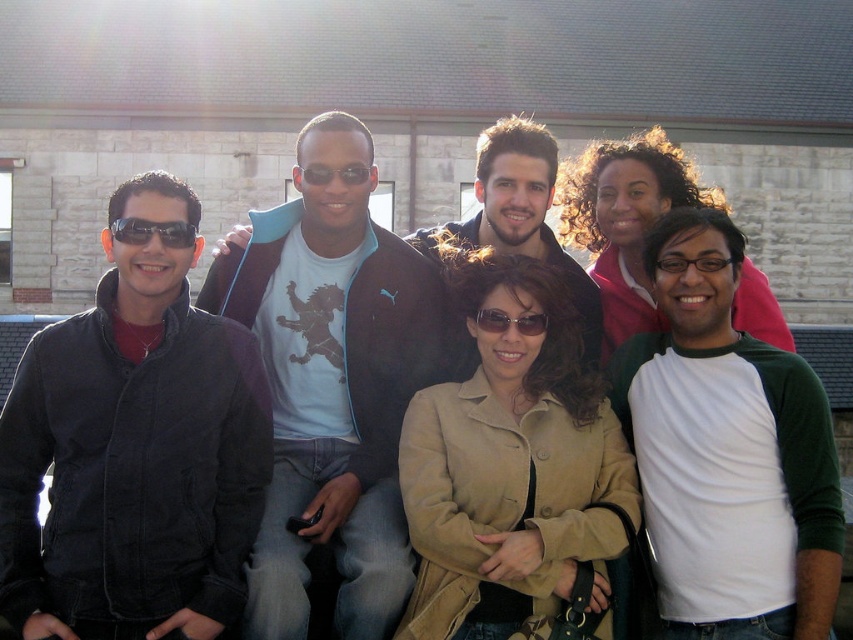
Question: Is light blue t-shirt at center bigger than sunglasses at center?

Choices:
 (A) no
 (B) yes

Answer: (B)

Question: Among these points, which one is nearest to the camera?

Choices:
 (A) (308, 177)
 (B) (543, 476)

Answer: (B)

Question: Can you confirm if white-green raglan shirt at center-right is smaller than matte black sunglasses at left?

Choices:
 (A) yes
 (B) no

Answer: (B)

Question: Based on their relative distances, which object is nearer to the matte black sunglasses at center?

Choices:
 (A) matte black jacket at left
 (B) light blue t-shirt with lion graphic at center
 (C) white-green raglan shirt at center-right
 (D) tan suede jacket at center

Answer: (D)

Question: Which of the following is the closest to the observer?

Choices:
 (A) (527, 378)
 (B) (20, 496)
 (C) (537, 330)

Answer: (B)

Question: Can you confirm if matte black jacket at left is bigger than matte black sunglasses at left?

Choices:
 (A) no
 (B) yes

Answer: (B)